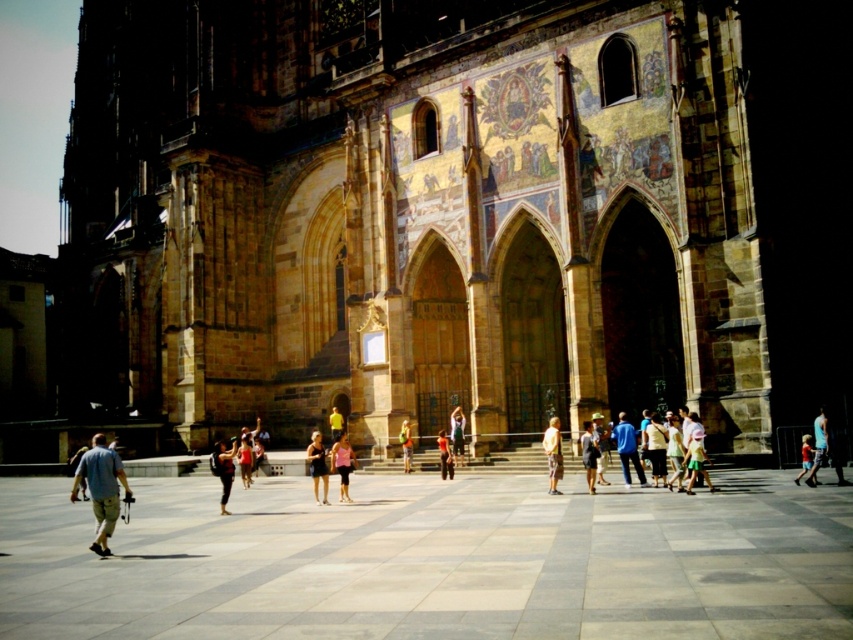
In the scene shown: You are a photographer planning to take a portrait of two models wearing the light pink fabric dress at center and orange fabric pants at center. Given their sizes, which model should you position closer to the camera to make them appear the same size in the photo?

The light pink fabric dress at center is smaller in size compared to the orange fabric pants at center. To make them appear the same size in the photo, the model wearing the light pink fabric dress at center should be positioned closer to the camera.

You are standing in front of the grand historic building and notice two items on the ground. The light blue cotton shirt at lower left and the pink fabric shorts at center. Which item has a larger width?

The light blue cotton shirt at lower left might be wider than pink fabric shorts at center according to the description, so it is possible that the light blue cotton shirt at lower left has a larger width.

You are a photographer aiming to capture a person standing in front of the cathedral. You notice a blue denim shorts at lower right and a red cotton shirt at lower right. Which clothing item is shorter in height?

The blue denim shorts at lower right is not as tall as the red cotton shirt at lower right, so the blue denim shorts at lower right is shorter in height.